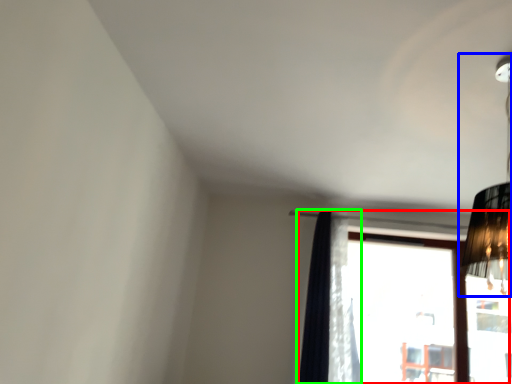
Question: Based on their relative distances, which object is nearer to window (highlighted by a red box)? Choose from lamp (highlighted by a blue box) and curtain (highlighted by a green box).

Choices:
 (A) lamp
 (B) curtain

Answer: (B)